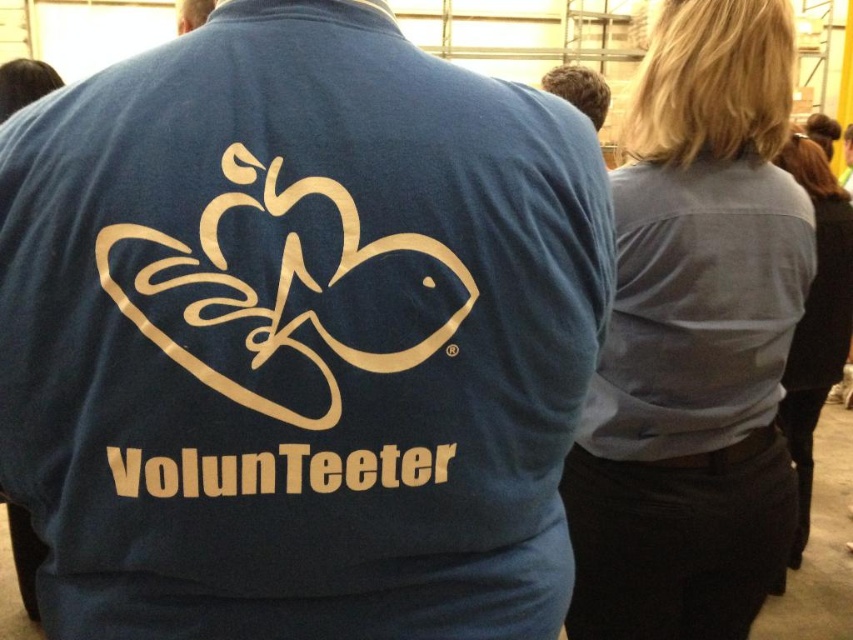
Which is behind, point (201, 328) or point (395, 449)?

Positioned behind is point (395, 449).

Based on the photo, is gold/smooth/swirl at upper center taller than goldmaterial/texturevolunteeter at center?

Yes.

Where is `gold/smooth/swirl at upper center`? Image resolution: width=853 pixels, height=640 pixels. gold/smooth/swirl at upper center is located at coordinates (277, 291).

Locate an element on the screen. This screenshot has height=640, width=853. gold/smooth/swirl at upper center is located at coordinates (277, 291).

Is matte blue shirt at center in front of gold/smooth/swirl at upper center?

No.

Who is positioned more to the right, matte blue shirt at center or gold/smooth/swirl at upper center?

Positioned to the right is matte blue shirt at center.

The width and height of the screenshot is (853, 640). Describe the element at coordinates (297, 336) in the screenshot. I see `matte blue shirt at center` at that location.

You are a GUI agent. You are given a task and a screenshot of the screen. Output one action in this format:
    pyautogui.click(x=<x>, y=<y>)
    Task: Click on the matte blue shirt at center
    The image size is (853, 640).
    Given the screenshot: What is the action you would take?
    pyautogui.click(x=297, y=336)

Can you confirm if matte blue shirt at center is thinner than goldmaterial/texturevolunteeter at center?

In fact, matte blue shirt at center might be wider than goldmaterial/texturevolunteeter at center.

Is point (199, 58) closer to camera compared to point (227, 470)?

No, (199, 58) is behind (227, 470).

Is point (248, 280) closer to camera compared to point (345, 474)?

Yes.

Image resolution: width=853 pixels, height=640 pixels. Identify the location of matte blue shirt at center. (297, 336).